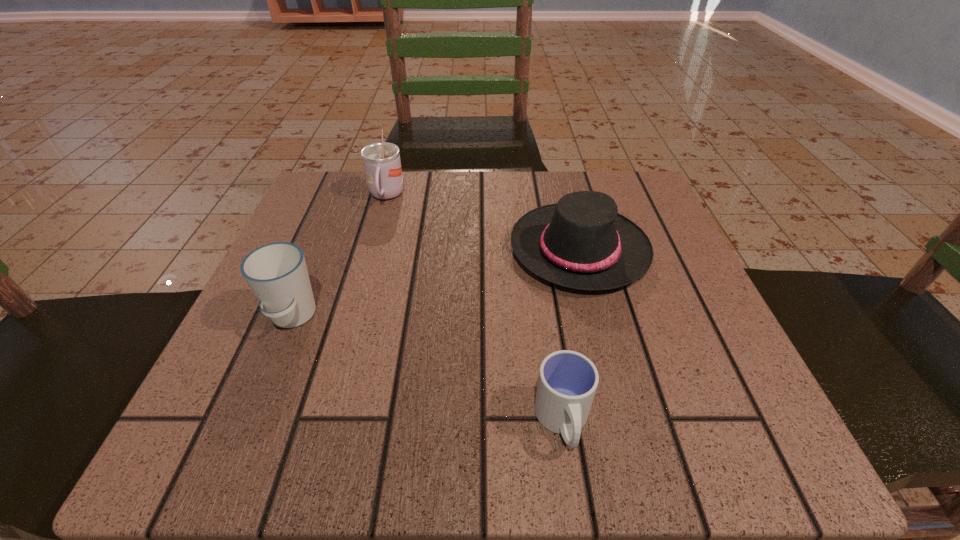
You are a GUI agent. You are given a task and a screenshot of the screen. Output one action in this format:
    pyautogui.click(x=<x>, y=<y>)
    Task: Click on the cup present at the far edge
    
    Given the screenshot: What is the action you would take?
    pyautogui.click(x=382, y=165)

You are a GUI agent. You are given a task and a screenshot of the screen. Output one action in this format:
    pyautogui.click(x=<x>, y=<y>)
    Task: Click on the dress hat that is at the far edge
    
    Given the screenshot: What is the action you would take?
    pyautogui.click(x=581, y=242)

Identify the location of object that is at the near edge. (567, 382).

Where is `object positioned at the right edge`? This screenshot has height=540, width=960. object positioned at the right edge is located at coordinates (581, 242).

Where is `object present at the far left corner`? object present at the far left corner is located at coordinates (382, 165).

The width and height of the screenshot is (960, 540). I want to click on object located at the far right corner, so click(x=581, y=242).

This screenshot has height=540, width=960. In the image, there is a desktop. What are the coordinates of `blank space at the far edge` in the screenshot? It's located at (522, 175).

This screenshot has height=540, width=960. In the image, there is a desktop. What are the coordinates of `vacant space at the near edge` in the screenshot? It's located at (460, 457).

Locate an element on the screen. Image resolution: width=960 pixels, height=540 pixels. free space at the left edge of the desktop is located at coordinates (328, 366).

The width and height of the screenshot is (960, 540). Find the location of `vacant region at the right edge of the desktop`. vacant region at the right edge of the desktop is located at coordinates (671, 386).